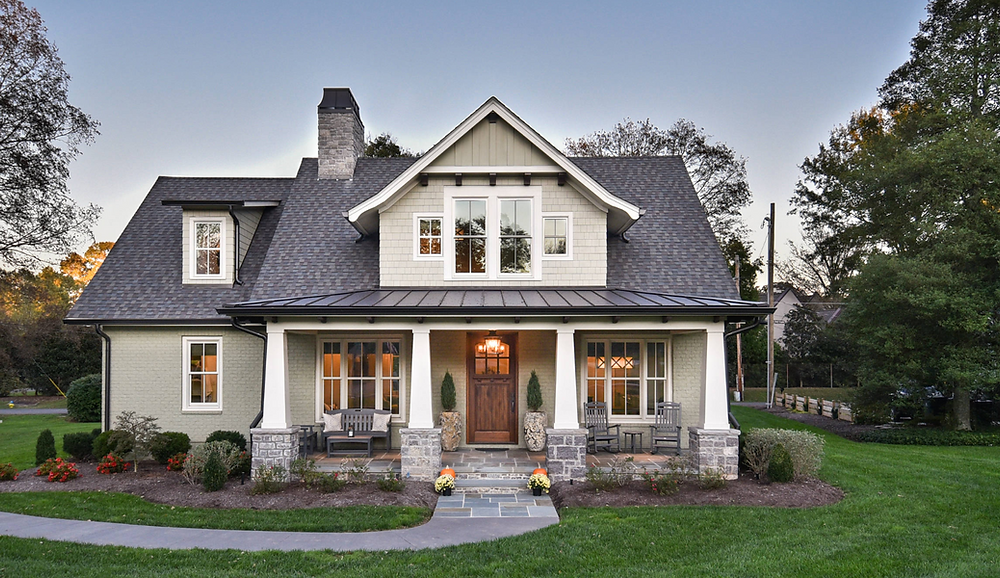
Image resolution: width=1000 pixels, height=578 pixels. Identify the location of windows. (208, 243), (207, 366), (362, 386), (431, 238), (468, 239), (521, 242), (554, 242), (622, 386), (494, 358).